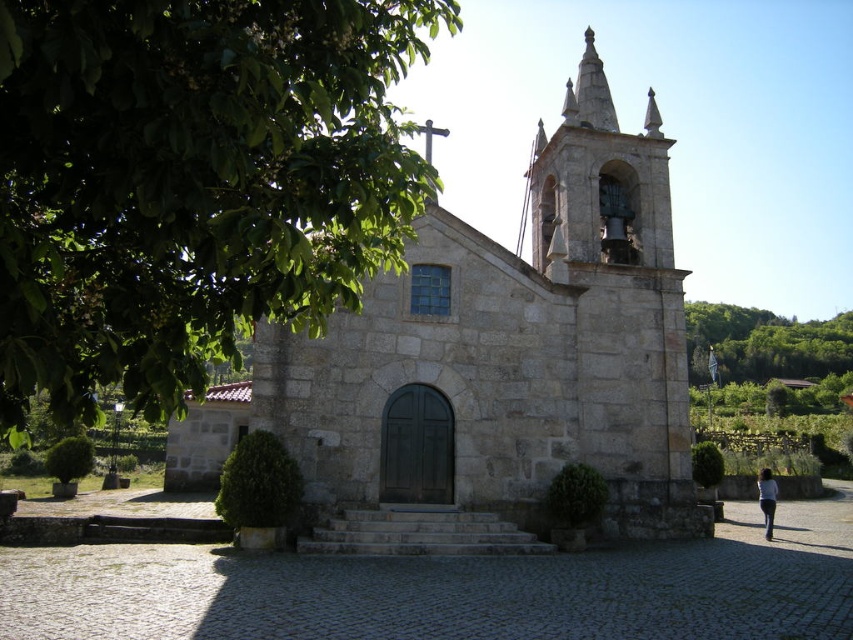
You are standing in front of the stone church at center and want to take a photo of the green leafy tree at upper left. Which object should you focus on first when adjusting your camera lens?

You should focus on the green leafy tree at upper left first because it is closer to the viewer than the stone church at center.

From the picture: You are standing in front of the church and want to place a small statue between the green leafy tree at upper left and the dark blue fabric at lower right. Based on their positions, which object should the statue be closer to if it needs to be near the front of the scene?

The statue should be closer to the green leafy tree at upper left because it is nearer to the viewer than the dark blue fabric at lower right.